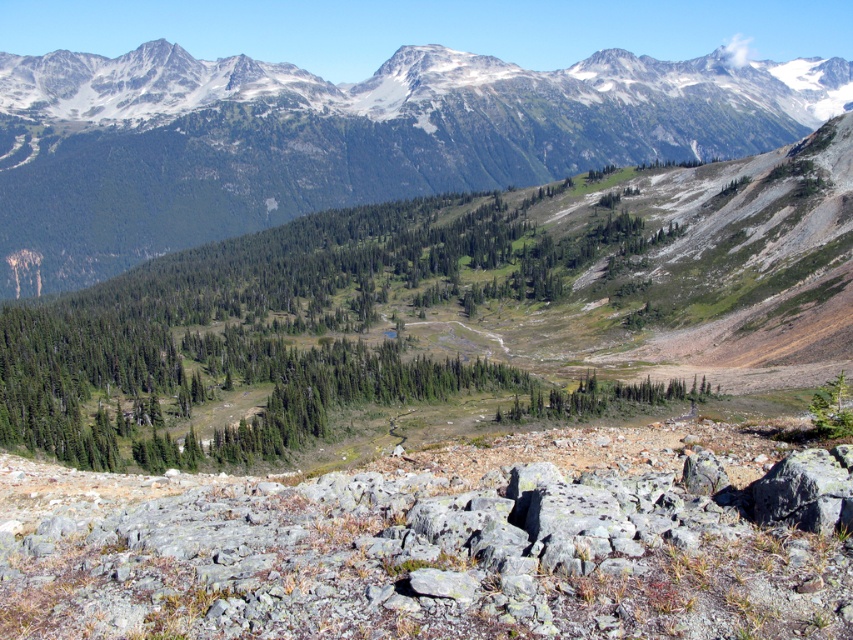
You are a hiker planning to climb the green forested mountain range at upper center. You notice a gray rock at center in your path. Based on the scene, which object is closer to you as you start your hike?

The gray rock at center is closer to you than the green forested mountain range at upper center since it is positioned below it in the scene.

You are a hiker planning to take a photo of the gray rock at center and the green forested mountain range at upper center. Which object should you position closer to the left side of your camera frame?

The gray rock at center should be positioned closer to the left side of your camera frame because it is located on the left side of the green forested mountain range at upper center.

You are a hiker planning to climb the gray rock at center and the green forested mountain range at upper center. Which one do you think will require more effort due to its height?

The green forested mountain range at upper center is taller than the gray rock at center, so climbing it will require more effort due to its greater height.